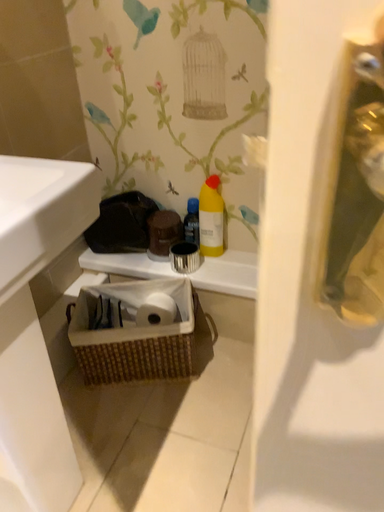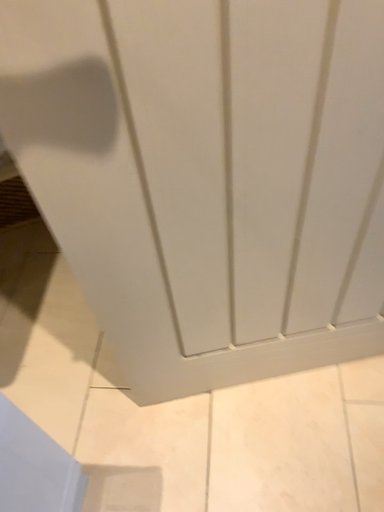
Question: Which way did the camera rotate in the video?

Choices:
 (A) rotated left
 (B) rotated right

Answer: (B)